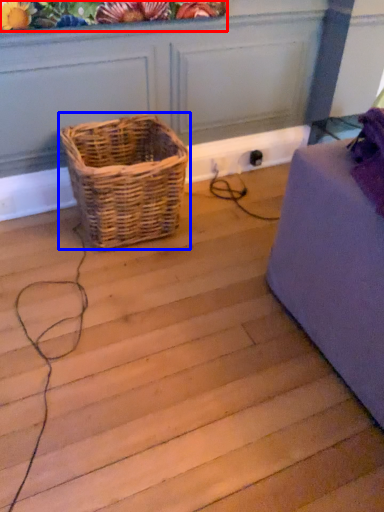
Question: Which object appears closest to the camera in this image, floral arrangement (highlighted by a red box) or picnic basket (highlighted by a blue box)?

Choices:
 (A) floral arrangement
 (B) picnic basket

Answer: (A)